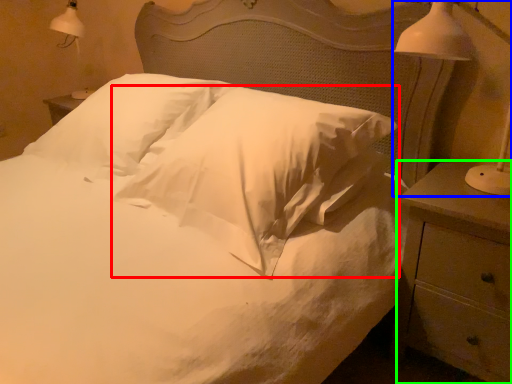
Question: Which is nearer to the pillow (highlighted by a red box)? bedside lamp (highlighted by a blue box) or nightstand (highlighted by a green box).

Choices:
 (A) bedside lamp
 (B) nightstand

Answer: (B)